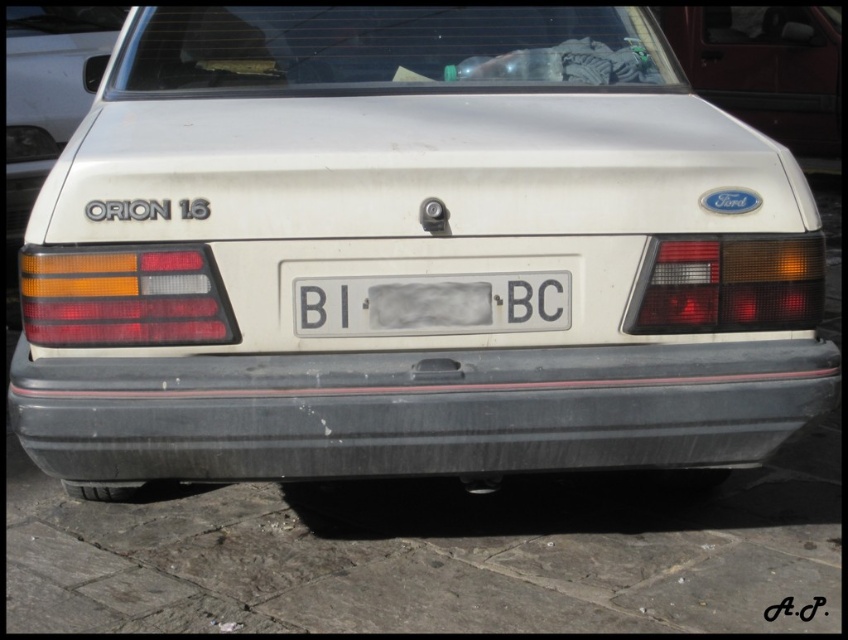
You are a delivery drone operator. Your drone needs to fly over the matte white car at upper right and the white plastic license plate at center. Which object should the drone fly higher to clear both?

The drone should fly higher to clear the matte white car at upper right since it is taller than the white plastic license plate at center.

You are a delivery person needing to attach a small package to the trunk of the Ford Orion 1.6 car. The package is 12 inches wide. You have two options to place it either on the black matte bumper at center or on the white plastic license plate at center. Which location can accommodate the package without exceeding its width?

The black matte bumper at center has a greater width than the white plastic license plate at center. Since the package is 12 inches wide, the black matte bumper at center would be the better option as it can accommodate the package without exceeding its width.

You are a delivery person trying to park a 2.0 meters long delivery van behind the Ford Orion 1.6 car. The van needs to be parked directly behind the car. Based on the image, is there enough space between the black matte bumper at center and the end of the paved surface to accommodate the van?

The distance between the black matte bumper at center and the end of the paved surface is 2.11 meters. Since the van is 2.0 meters long, there is enough space to park the van behind the car as the available space is slightly longer than the van.